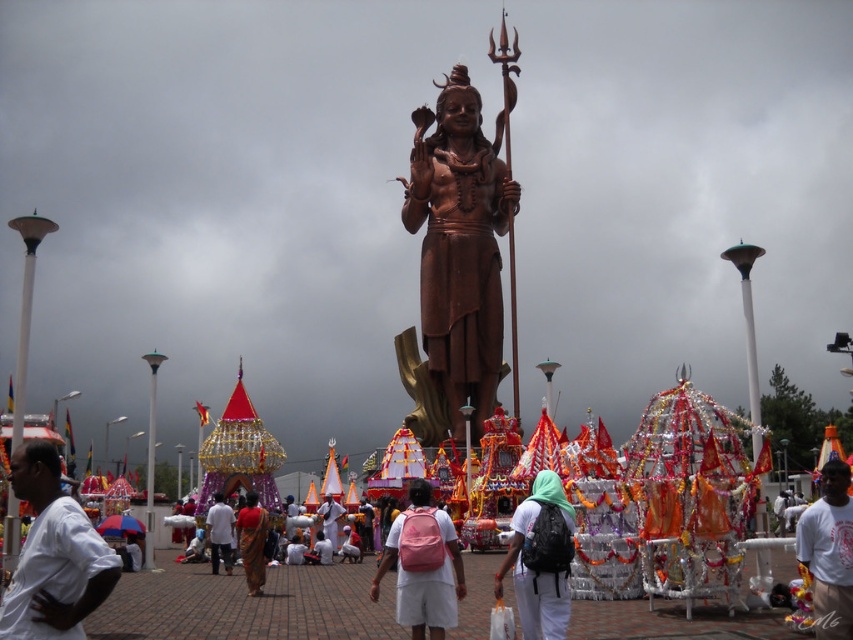
Question: Does white cotton shirt at center have a smaller size compared to white fabric at center?

Choices:
 (A) no
 (B) yes

Answer: (A)

Question: Is matte red sari at center smaller than white fabric at center?

Choices:
 (A) yes
 (B) no

Answer: (B)

Question: Which of the following is the farthest from the observer?

Choices:
 (A) [x=236, y=524]
 (B) [x=334, y=552]

Answer: (B)

Question: Is bronze statue at center to the left of pink fabric at center from the viewer's perspective?

Choices:
 (A) yes
 (B) no

Answer: (B)

Question: Which of the following is the farthest from the observer?

Choices:
 (A) white matte backpack at center
 (B) pink fabric backpack at center
 (C) white t-shirt at center
 (D) white fabric at center

Answer: (D)

Question: Which object is the closest to the bronze statue at center?

Choices:
 (A) white cotton shirt at center
 (B) pink fabric backpack at center

Answer: (B)